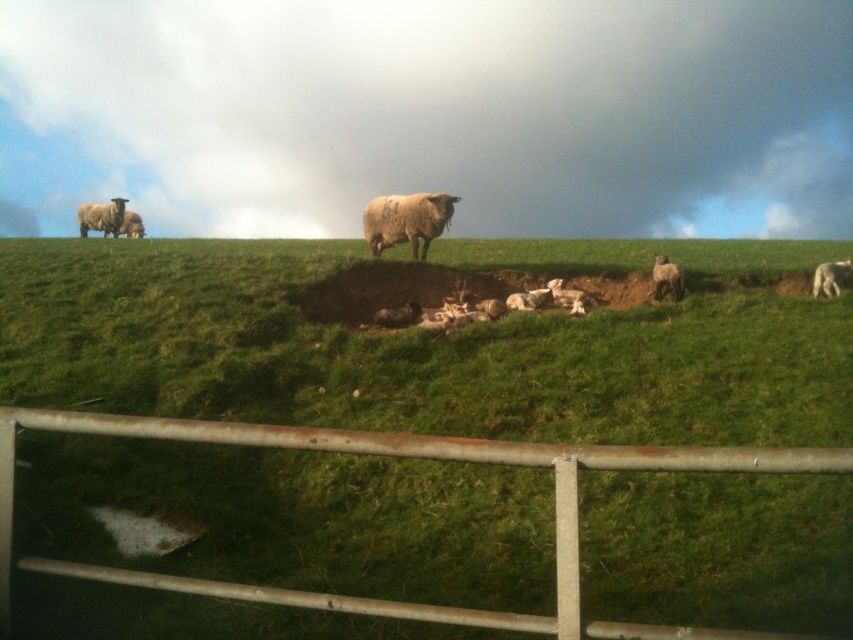
Question: Can you confirm if white woolen sheep at center is positioned below white woolly sheep at left?

Choices:
 (A) yes
 (B) no

Answer: (A)

Question: Can you confirm if white woolly sheep at upper left is positioned to the left of white woolly sheep at center?

Choices:
 (A) no
 (B) yes

Answer: (B)

Question: Based on their relative distances, which object is nearer to the white woolen sheep at center?

Choices:
 (A) white woolly sheep at center
 (B) white woolly sheep at left
 (C) rusty metal fence at lower center

Answer: (A)

Question: Which of the following is the farthest from the observer?

Choices:
 (A) fuzzy woolly sheep at center
 (B) white woolly sheep at left

Answer: (B)

Question: Among these points, which one is farthest from the camera?

Choices:
 (A) (683, 289)
 (B) (831, 282)
 (C) (434, 204)
 (D) (432, 435)

Answer: (C)

Question: Is rusty metal fence at lower center positioned before white woolen sheep at center?

Choices:
 (A) yes
 (B) no

Answer: (A)